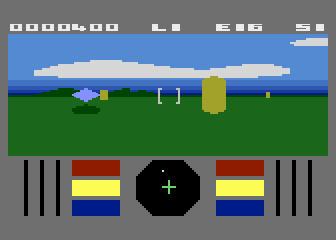
Locate an element on the screen. This screenshot has height=240, width=336. blue floor is located at coordinates (83, 95).